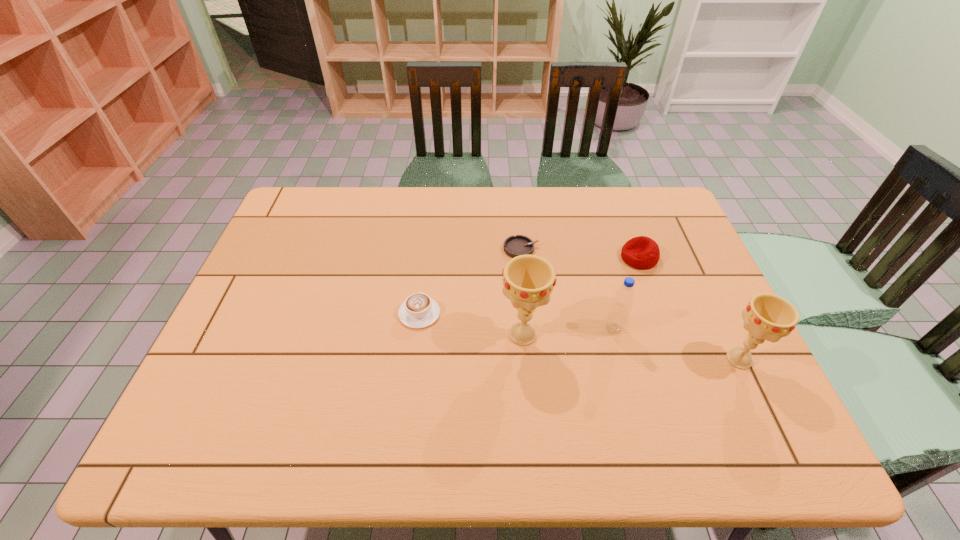
I want to click on vacant space at the near right corner, so click(744, 399).

Find the location of `free space between the water bottle and the ashtray`. free space between the water bottle and the ashtray is located at coordinates (567, 288).

Locate an element on the screen. blank region between the shortest object and the fifth tallest object is located at coordinates (470, 281).

Identify the location of unoccupied position between the left chalice and the water bottle. This screenshot has width=960, height=540. (568, 332).

Locate an element on the screen. This screenshot has height=540, width=960. blank region between the second shortest object and the water bottle is located at coordinates (516, 321).

Locate an element on the screen. Image resolution: width=960 pixels, height=540 pixels. free spot between the second object from right to left and the tallest object is located at coordinates (581, 296).

This screenshot has height=540, width=960. What are the coordinates of `object that stands as the second closest to the shortest object` in the screenshot? It's located at (418, 311).

Identify which object is located as the nearest to the cappuccino. Please provide its 2D coordinates. Your answer should be formatted as a tuple, i.e. [(x, y)], where the tuple contains the x and y coordinates of a point satisfying the conditions above.

[(528, 280)]

Where is `free space that satisfies the following two spatial constraints: 1. on the front side of the ashtray; 2. on the left side of the third object from right to left`? free space that satisfies the following two spatial constraints: 1. on the front side of the ashtray; 2. on the left side of the third object from right to left is located at coordinates (529, 328).

This screenshot has height=540, width=960. Find the location of `vacant space that satisfies the following two spatial constraints: 1. on the front side of the right chalice; 2. on the left side of the fourth object from left to right`. vacant space that satisfies the following two spatial constraints: 1. on the front side of the right chalice; 2. on the left side of the fourth object from left to right is located at coordinates (622, 359).